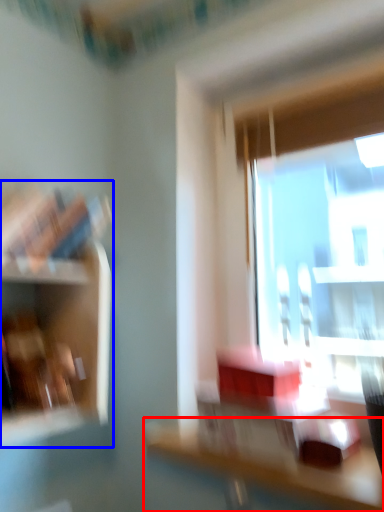
Question: Among these objects, which one is nearest to the camera, table (highlighted by a red box) or shelf (highlighted by a blue box)?

Choices:
 (A) table
 (B) shelf

Answer: (A)